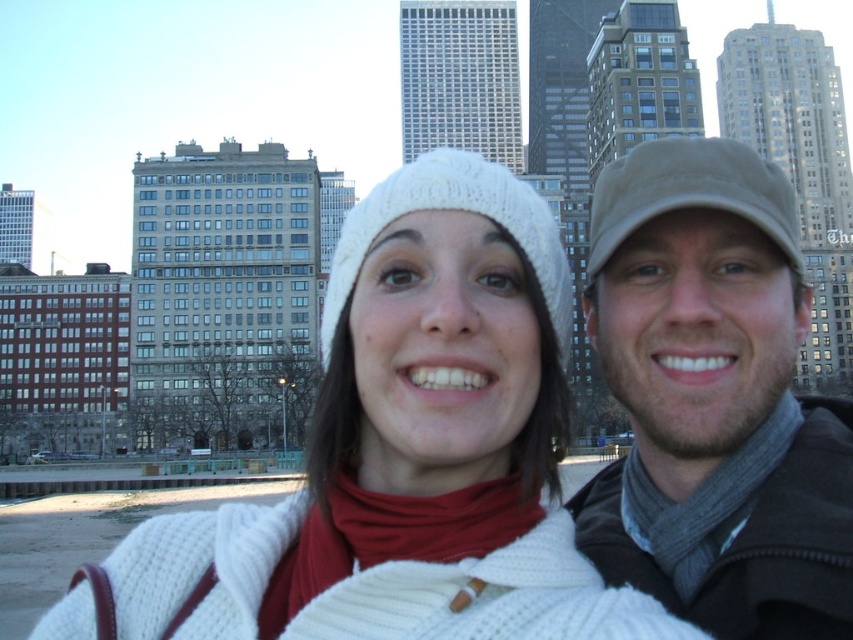
Question: Is white knitted hat at center above beige fabric cap at upper right?

Choices:
 (A) no
 (B) yes

Answer: (A)

Question: Which point is farther from the camera taking this photo?

Choices:
 (A) (752, 192)
 (B) (463, 182)

Answer: (A)

Question: Among these objects, which one is farthest from the camera?

Choices:
 (A) beige fabric cap at upper right
 (B) khaki fabric cap at upper right
 (C) white knitted hat at center

Answer: (A)

Question: Considering the real-world distances, which object is closest to the khaki fabric cap at upper right?

Choices:
 (A) beige fabric cap at upper right
 (B) white knitted hat at center

Answer: (A)

Question: Does khaki fabric cap at upper right appear under white knitted hat at center?

Choices:
 (A) yes
 (B) no

Answer: (A)

Question: Does white knitted hat at center appear over beige fabric cap at upper right?

Choices:
 (A) no
 (B) yes

Answer: (A)